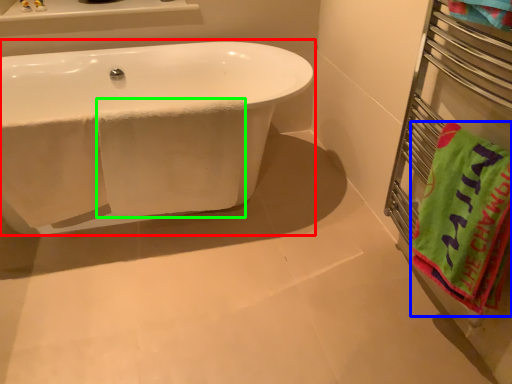
Question: Considering the real-world distances, which object is closest to bathtub (highlighted by a red box)? beach towel (highlighted by a blue box) or bath towel (highlighted by a green box).

Choices:
 (A) beach towel
 (B) bath towel

Answer: (B)